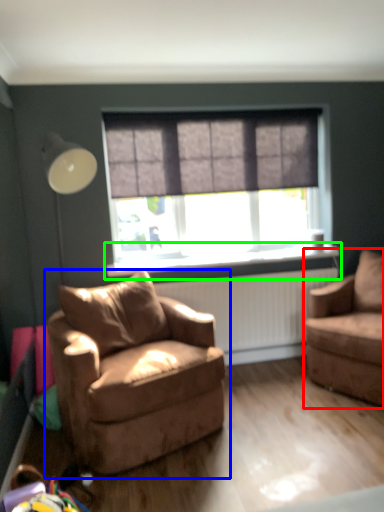
Question: Which object is the farthest from chair (highlighted by a red box)? Choose among these: chair (highlighted by a blue box) or window sill (highlighted by a green box).

Choices:
 (A) chair
 (B) window sill

Answer: (A)